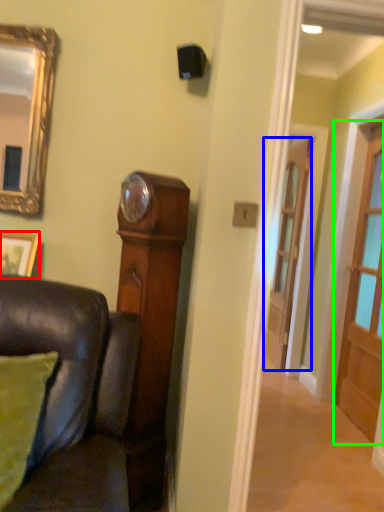
Question: Considering the real-world distances, which object is farthest from picture frame (highlighted by a red box)? door (highlighted by a blue box) or door (highlighted by a green box)?

Choices:
 (A) door
 (B) door

Answer: (A)